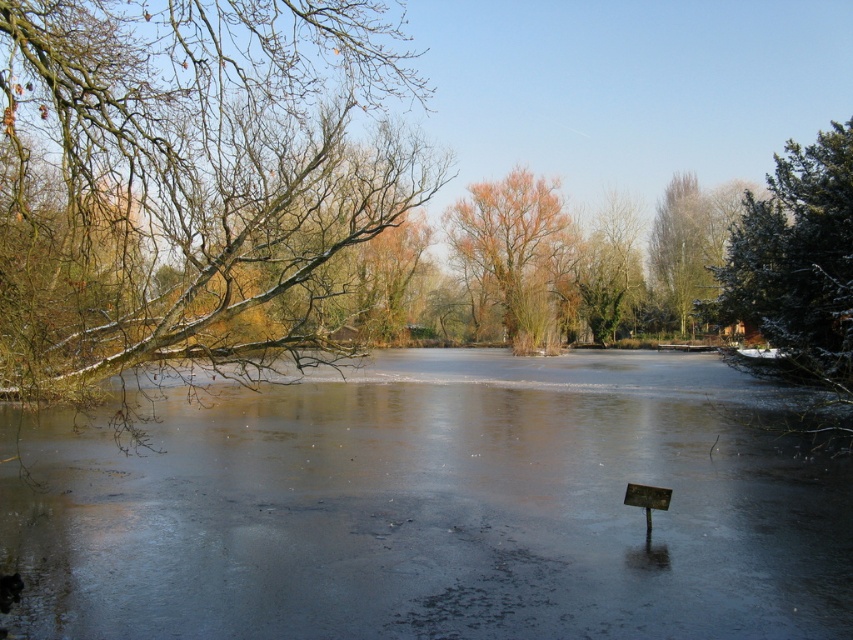
Between point (756, 292) and point (496, 248), which one is positioned behind?

Point (496, 248)

In the scene shown: Does green textured evergreen tree at right have a smaller size compared to orange-brown bark tree at center?

No, green textured evergreen tree at right is not smaller than orange-brown bark tree at center.

Locate an element on the screen. This screenshot has width=853, height=640. green textured evergreen tree at right is located at coordinates (799, 280).

Based on the photo, does transparent ice at center appear on the left side of orange-brown bark tree at center?

Indeed, transparent ice at center is positioned on the left side of orange-brown bark tree at center.

What do you see at coordinates (431, 508) in the screenshot? I see `transparent ice at center` at bounding box center [431, 508].

You are a GUI agent. You are given a task and a screenshot of the screen. Output one action in this format:
    pyautogui.click(x=<x>, y=<y>)
    Task: Click on the transparent ice at center
    The image size is (853, 640).
    Given the screenshot: What is the action you would take?
    pyautogui.click(x=431, y=508)

Which of these two, snow-covered branches at left or green leafy tree at upper center, stands shorter?

green leafy tree at upper center

Which of these two, snow-covered branches at left or green leafy tree at upper center, stands taller?

With more height is snow-covered branches at left.

Which is behind, point (149, 192) or point (688, 216)?

Positioned behind is point (688, 216).

Image resolution: width=853 pixels, height=640 pixels. Find the location of `snow-covered branches at left`. snow-covered branches at left is located at coordinates (189, 179).